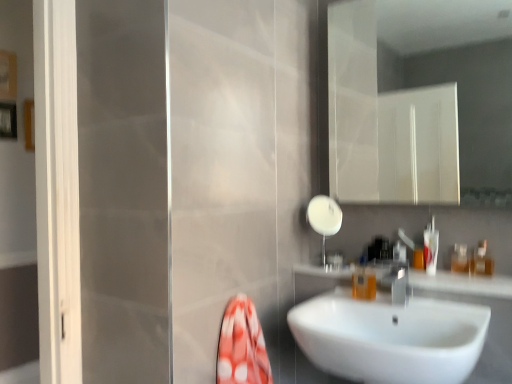
Where is `silver metallic tap at sink right`? This screenshot has width=512, height=384. silver metallic tap at sink right is located at coordinates (399, 285).

What do you see at coordinates (364, 283) in the screenshot? I see `translucent plastic bottle at right, the 1th toiletry in the left-to-right sequence` at bounding box center [364, 283].

Locate an element on the screen. translucent plastic bottle at right, the 1th toiletry in the left-to-right sequence is located at coordinates (364, 283).

Describe the element at coordinates (459, 259) in the screenshot. I see `translucent plastic container at right, arranged as the second toiletry when viewed from the left` at that location.

The width and height of the screenshot is (512, 384). Find the location of `translucent plastic container at right, marked as the second toiletry in a right-to-left arrangement`. translucent plastic container at right, marked as the second toiletry in a right-to-left arrangement is located at coordinates (459, 259).

The width and height of the screenshot is (512, 384). What are the coordinates of `white glossy sink at center` in the screenshot? It's located at (462, 284).

Between white glossy sink at center and white glossy shower at upper center, which one has more height?

white glossy sink at center is taller.

Visually, is white glossy sink at center positioned to the left or to the right of white glossy shower at upper center?

Clearly, white glossy sink at center is on the right of white glossy shower at upper center in the image.

Who is smaller, white glossy sink at center or white glossy shower at upper center?

white glossy shower at upper center.

Is white glossy sink at center looking in the opposite direction of white glossy shower at upper center?

white glossy sink at center does not have its back to white glossy shower at upper center.

You are a GUI agent. You are given a task and a screenshot of the screen. Output one action in this format:
    pyautogui.click(x=<x>, y=<y>)
    Task: Click on the toiletry behind the translucent plastic bottle at right, which is counted as the third toiletry, starting from the left
    
    Given the screenshot: What is the action you would take?
    pyautogui.click(x=459, y=259)

From the image's perspective, is translucent plastic container at right, arranged as the second toiletry when viewed from the left, on translucent plastic bottle at right, the 1th toiletry from the right?

No.

From a real-world perspective, which object rests below the other?

From a 3D spatial view, translucent plastic container at right, marked as the second toiletry in a right-to-left arrangement, is below.

Is translucent plastic bottle at right, which is counted as the third toiletry, starting from the left, at the back of translucent plastic container at right, marked as the second toiletry in a right-to-left arrangement?

No, translucent plastic bottle at right, which is counted as the third toiletry, starting from the left, is not at the back of translucent plastic container at right, marked as the second toiletry in a right-to-left arrangement.

Considering the positions of point (336, 229) and point (488, 269), is point (336, 229) closer or farther from the camera than point (488, 269)?

Clearly, point (336, 229) is more distant from the camera than point (488, 269).

Locate an element on the screen. shower behind the translucent plastic bottle at right, the 1th toiletry from the right is located at coordinates (324, 218).

From the image's perspective, is white glossy shower at upper center above or below translucent plastic bottle at right, which is counted as the third toiletry, starting from the left?

white glossy shower at upper center is above translucent plastic bottle at right, which is counted as the third toiletry, starting from the left.

From a real-world perspective, relative to translucent plastic bottle at right, which is counted as the third toiletry, starting from the left, is white glossy shower at upper center vertically above or below?

In terms of real-world spatial position, white glossy shower at upper center is above translucent plastic bottle at right, which is counted as the third toiletry, starting from the left.

From the image's perspective, would you say white glossy shower at upper center is shown under translucent plastic container at right, arranged as the second toiletry when viewed from the left?

Incorrect, from the image's perspective, white glossy shower at upper center is higher than translucent plastic container at right, arranged as the second toiletry when viewed from the left.

Is white glossy shower at upper center thinner than translucent plastic container at right, marked as the second toiletry in a right-to-left arrangement?

No, white glossy shower at upper center is not thinner than translucent plastic container at right, marked as the second toiletry in a right-to-left arrangement.

Considering the points (316, 218) and (463, 257), which point is behind, point (316, 218) or point (463, 257)?

The point (316, 218) is more distant.

Between white glossy shower at upper center and translucent plastic container at right, marked as the second toiletry in a right-to-left arrangement, which one appears on the left side from the viewer's perspective?

From the viewer's perspective, white glossy shower at upper center appears more on the left side.

Could you tell me if silver metallic tap at sink right is facing white glossy sink at center?

No, silver metallic tap at sink right is not turned towards white glossy sink at center.

Which object is further away from the camera, silver metallic tap at sink right or white glossy sink at center?

silver metallic tap at sink right is further away from the camera.

Is silver metallic tap at sink right completely or partially outside of white glossy sink at center?

silver metallic tap at sink right is positioned outside white glossy sink at center.

Would you consider silver metallic tap at sink right to be distant from white glossy sink at center?

No, silver metallic tap at sink right is in close proximity to white glossy sink at center.

Looking at this image, which object is positioned more to the left, white glossy sink at center or translucent plastic bottle at right, the third toiletry viewed from the right?

translucent plastic bottle at right, the third toiletry viewed from the right, is more to the left.

Considering the points (498, 290) and (362, 283), which point is behind, point (498, 290) or point (362, 283)?

The point (362, 283) is more distant.

Which object is more forward, white glossy sink at center or translucent plastic bottle at right, the third toiletry viewed from the right?

white glossy sink at center.

Locate an element on the screen. The width and height of the screenshot is (512, 384). toiletry located below the translucent plastic container at right, marked as the second toiletry in a right-to-left arrangement (from the image's perspective) is located at coordinates (364, 283).

From a real-world perspective, is translucent plastic bottle at right, the 1th toiletry in the left-to-right sequence, on top of translucent plastic container at right, marked as the second toiletry in a right-to-left arrangement?

No.

Which object is closer to the camera, translucent plastic bottle at right, the 1th toiletry in the left-to-right sequence, or translucent plastic container at right, arranged as the second toiletry when viewed from the left?

translucent plastic bottle at right, the 1th toiletry in the left-to-right sequence.

Is translucent plastic container at right, marked as the second toiletry in a right-to-left arrangement, at the back of translucent plastic bottle at right, the 1th toiletry in the left-to-right sequence?

translucent plastic bottle at right, the 1th toiletry in the left-to-right sequence, does not have its back to translucent plastic container at right, marked as the second toiletry in a right-to-left arrangement.

Image resolution: width=512 pixels, height=384 pixels. What are the coordinates of `sink that is under the white glossy shower at upper center (from a real-world perspective)` in the screenshot? It's located at (383, 332).

Locate an element on the screen. This screenshot has height=384, width=512. toiletry that is the 1st object to the left of the translucent plastic bottle at right, the 1th toiletry from the right, starting at the anchor is located at coordinates (459, 259).

Consider the image. Looking at the image, which one is located closer to white glossy sink at center, translucent plastic bottle at right, the 1th toiletry from the right, or white glossy shower at upper center?

Among the two, translucent plastic bottle at right, the 1th toiletry from the right, is located nearer to white glossy sink at center.

Consider the image. Based on their spatial positions, is white glossy sink at center or translucent plastic bottle at right, which is counted as the third toiletry, starting from the left, closer to white glossy sink at center?

white glossy sink at center lies closer to white glossy sink at center than the other object.

Which object lies further to the anchor point white glossy sink at center, white glossy shower at upper center or translucent plastic container at right, arranged as the second toiletry when viewed from the left?

Among the two, white glossy shower at upper center is located further to white glossy sink at center.

Estimate the real-world distances between objects in this image. Which object is closer to translucent plastic bottle at right, which is counted as the third toiletry, starting from the left, silver metallic tap at sink right or white glossy shower at upper center?

silver metallic tap at sink right is closer to translucent plastic bottle at right, which is counted as the third toiletry, starting from the left.

Based on the photo, from the image, which object appears to be farther from white glossy sink at center, translucent plastic container at right, arranged as the second toiletry when viewed from the left, or white glossy sink at center?

Based on the image, translucent plastic container at right, arranged as the second toiletry when viewed from the left, appears to be further to white glossy sink at center.

Looking at the image, which one is located further to white glossy sink at center, translucent plastic bottle at right, which is counted as the third toiletry, starting from the left, or white glossy shower at upper center?

translucent plastic bottle at right, which is counted as the third toiletry, starting from the left.

When comparing their distances from silver metallic tap at sink right, does translucent plastic bottle at right, the third toiletry viewed from the right, or white glossy shower at upper center seem closer?

translucent plastic bottle at right, the third toiletry viewed from the right, is positioned closer to the anchor silver metallic tap at sink right.

Looking at the image, which one is located further to translucent plastic container at right, marked as the second toiletry in a right-to-left arrangement, translucent plastic bottle at right, the 1th toiletry in the left-to-right sequence, or white glossy sink at center?

Among the two, translucent plastic bottle at right, the 1th toiletry in the left-to-right sequence, is located further to translucent plastic container at right, marked as the second toiletry in a right-to-left arrangement.

Find the location of a particular element. tap between white glossy sink at center and translucent plastic container at right, arranged as the second toiletry when viewed from the left, in the front-back direction is located at coordinates (399, 285).

I want to click on counter top located between silver metallic tap at sink right and translucent plastic bottle at right, which is counted as the third toiletry, starting from the left, in the left-right direction, so click(462, 284).

What are the coordinates of `tap located between white glossy sink at center and white glossy shower at upper center in the depth direction` in the screenshot? It's located at (399, 285).

This screenshot has width=512, height=384. I want to click on counter top located between white glossy shower at upper center and translucent plastic container at right, marked as the second toiletry in a right-to-left arrangement, in the left-right direction, so click(462, 284).